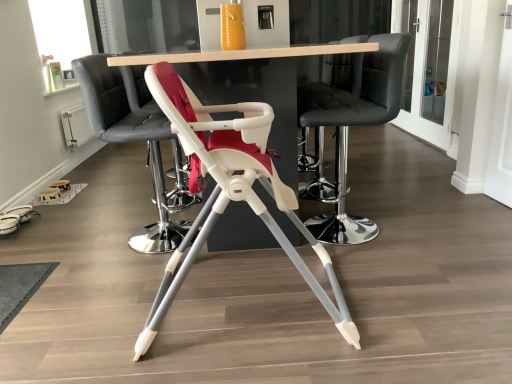
Locate an element on the screen. The width and height of the screenshot is (512, 384). vacant area that lies between white plastic highchair at center, which is the first chair in front-to-back order, and wooden table at center is located at coordinates (303, 291).